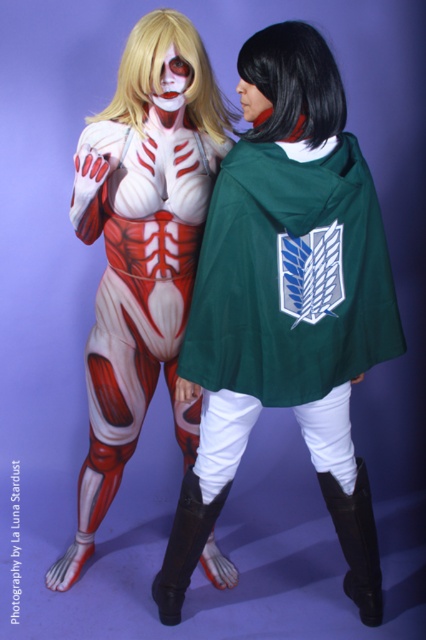
You are a costume designer assessing two elements in the image of the Attack on Titan cosplayers. You need to determine which of the two items, the green fabric cape at center or the black silky wig at center, extends higher upwards. Which one is taller?

The green fabric cape at center has a greater height compared to the black silky wig at center, so the green fabric cape at center is taller.

You are a photographer setting up for a photoshoot with two wigs displayed on mannequin heads. The black silky wig at center and the blonde wig at upper center need to be positioned exactly 25 centimeters apart. Based on their current positions, do you need to move them closer or farther apart to meet the requirement?

The black silky wig at center is currently 23.72 centimeters away from the blonde wig at upper center. To reach the required 25 centimeters, you need to move them slightly farther apart.

You are a photographer trying to capture a clear shot of both the green fabric cape at center and the blonde wig at upper center. Which object should you focus on first to ensure both are in focus?

The green fabric cape at center is closer to the viewer than the blonde wig at upper center. To ensure both are in focus, you should focus on the green fabric cape at center first, as it is the closer object.